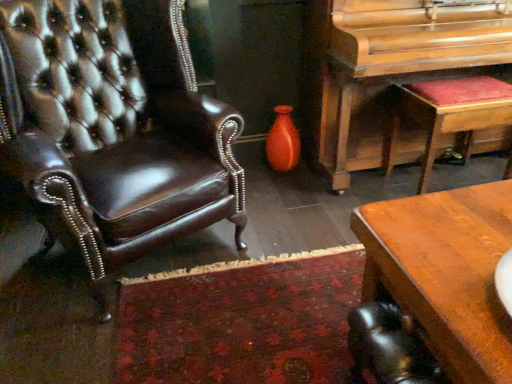
Question: Relative to matte orange vase at center, is velvet red stool at right in front or behind?

Choices:
 (A) front
 (B) behind

Answer: (A)

Question: In terms of size, does velvet red stool at right appear bigger or smaller than matte orange vase at center?

Choices:
 (A) small
 (B) big

Answer: (B)

Question: Considering the real-world distances, which object is farthest from the wooden polished piano at right?

Choices:
 (A) brown leather chair at left
 (B) matte orange vase at center
 (C) brown wooden desk at lower right
 (D) velvet red stool at right

Answer: (C)

Question: Estimate the real-world distances between objects in this image. Which object is farther from the velvet red stool at right?

Choices:
 (A) brown wooden desk at lower right
 (B) wooden polished piano at right
 (C) brown leather chair at left
 (D) matte orange vase at center

Answer: (C)